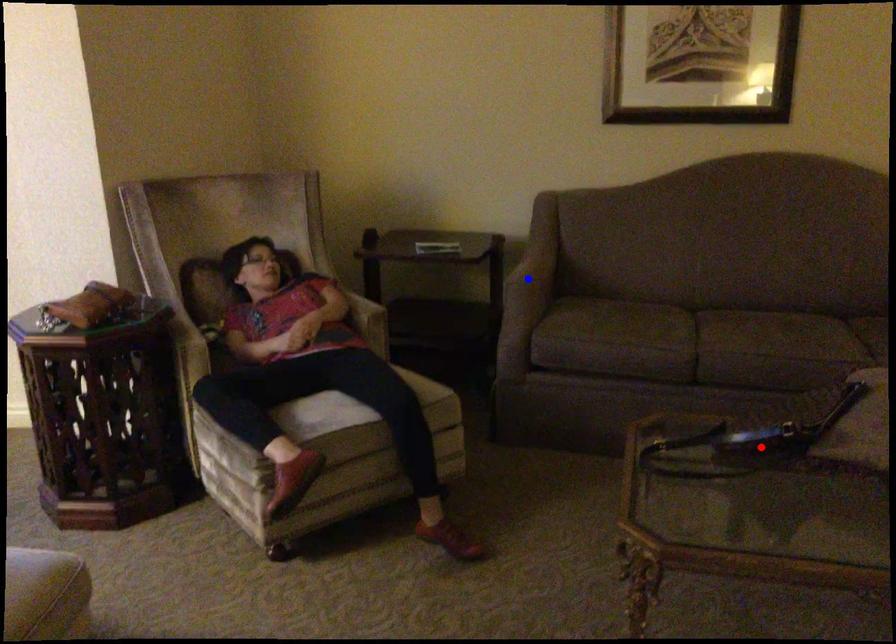
Question: Which of the two points in the image is closer to the camera?

Choices:
 (A) Blue point is closer.
 (B) Red point is closer.

Answer: (B)